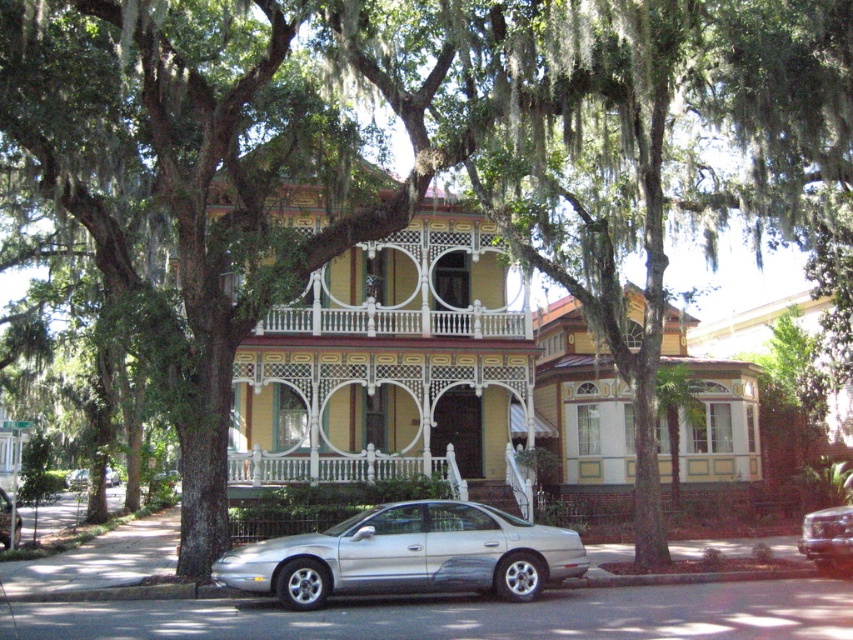
Does metallic silver sedan at center appear on the right side of silver metallic sedan at lower left?

Correct, you'll find metallic silver sedan at center to the right of silver metallic sedan at lower left.

Between point (820, 563) and point (18, 532), which one is positioned in front?

Point (820, 563) is more forward.

Locate an element on the screen. metallic silver sedan at center is located at coordinates (828, 538).

Who is positioned more to the left, metallic silver sedan at center or silver metallic sedan at center?

From the viewer's perspective, silver metallic sedan at center appears more on the left side.

Who is lower down, metallic silver sedan at center or silver metallic sedan at center?

Positioned lower is silver metallic sedan at center.

Describe the element at coordinates (828, 538) in the screenshot. The image size is (853, 640). I see `metallic silver sedan at center` at that location.

The image size is (853, 640). I want to click on metallic silver sedan at center, so click(828, 538).

Can you confirm if silver metallic car at center is positioned to the right of metallic silver sedan at center?

No, silver metallic car at center is not to the right of metallic silver sedan at center.

Can you confirm if silver metallic car at center is positioned above metallic silver sedan at center?

Yes.

Does point (573, 566) lie in front of point (805, 532)?

That is True.

The image size is (853, 640). I want to click on silver metallic car at center, so click(407, 556).